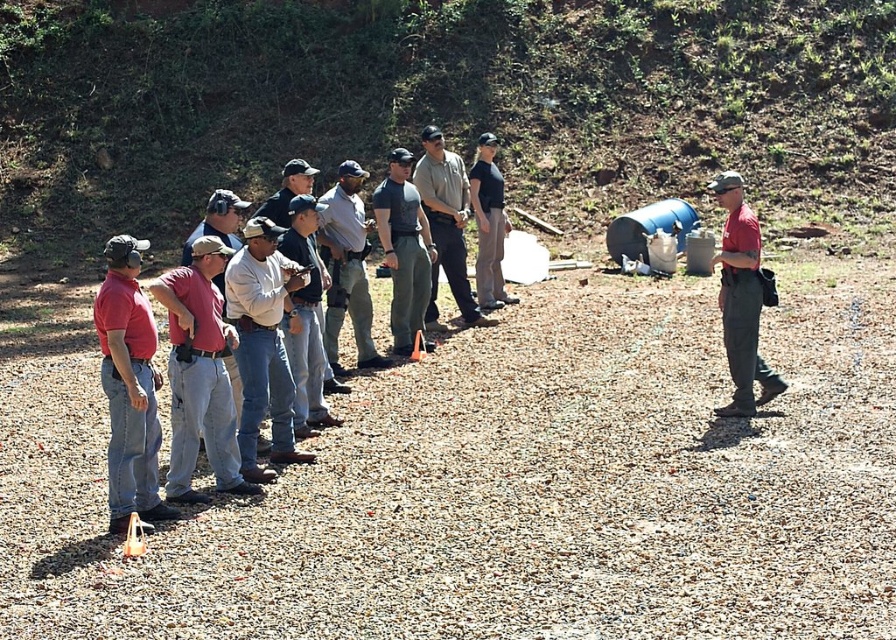
Question: Which of the following is the farthest from the observer?

Choices:
 (A) click(x=272, y=227)
 (B) click(x=127, y=403)
 (C) click(x=836, y=634)
 (D) click(x=326, y=234)

Answer: (D)

Question: Among these points, which one is farthest from the camera?

Choices:
 (A) (337, 422)
 (B) (483, 259)
 (C) (132, 484)
 (D) (274, 282)

Answer: (B)

Question: Observing the image, what is the correct spatial positioning of light brown leather jacket at center in reference to black cotton shirt at center?

Choices:
 (A) left
 (B) right

Answer: (A)

Question: Does gray fabric shirt at center appear over dark gray matte t-shirt at center?

Choices:
 (A) no
 (B) yes

Answer: (A)

Question: Can you confirm if matte red shirt at left is positioned to the right of dark gray matte t-shirt at center?

Choices:
 (A) yes
 (B) no

Answer: (B)

Question: Which of the following is the farthest from the observer?

Choices:
 (A) (358, 221)
 (B) (745, 348)

Answer: (A)